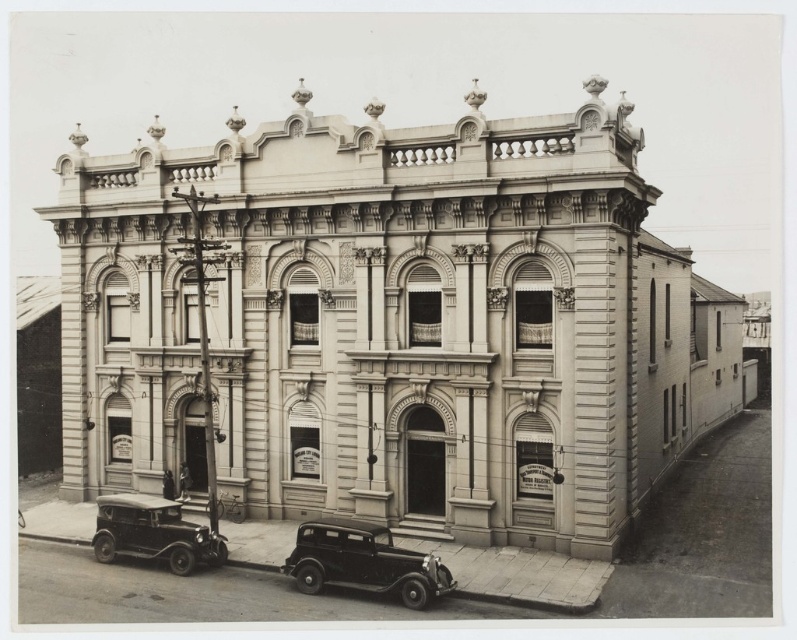
Between shiny black car at lower center and shiny black car at lower left, which one appears on the left side from the viewer's perspective?

shiny black car at lower left

Is shiny black car at lower center thinner than shiny black car at lower left?

Correct, shiny black car at lower center's width is less than shiny black car at lower left's.

Is point (418, 602) behind point (112, 525)?

No, it is in front of (112, 525).

Locate an element on the screen. The image size is (797, 640). shiny black car at lower center is located at coordinates (363, 561).